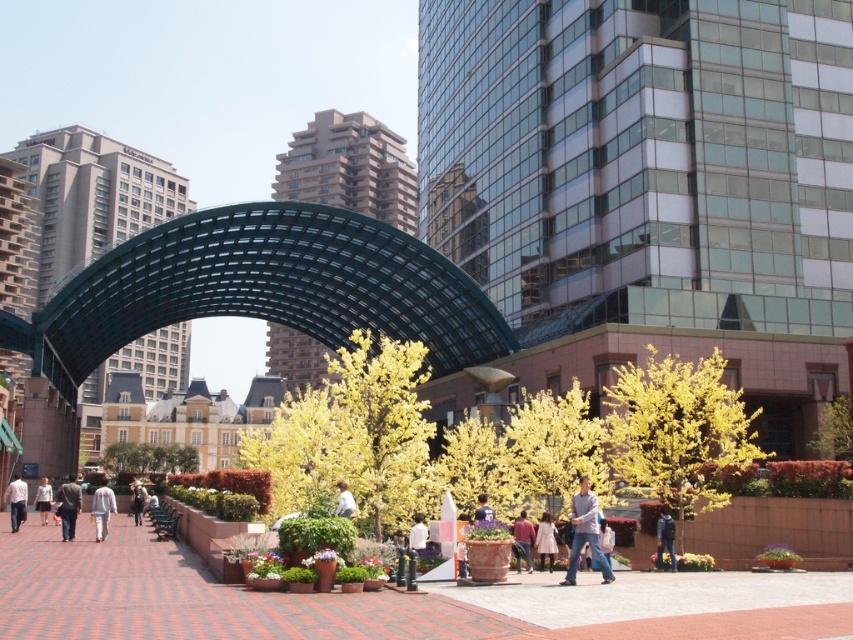
Question: Does matte brown coat at center appear on the right side of light brown leather jacket at center?

Choices:
 (A) no
 (B) yes

Answer: (B)

Question: In this image, where is brick pavement at center located relative to dark blue jacket at center?

Choices:
 (A) above
 (B) below

Answer: (B)

Question: Does dark blue jacket at center have a smaller size compared to light brown shirt at lower left?

Choices:
 (A) yes
 (B) no

Answer: (A)

Question: Which object is the farthest from the light gray cotton shirt at center?

Choices:
 (A) light brown leather jacket at center
 (B) light beige fabric jacket at lower left
 (C) light brown shirt at lower left
 (D) denim jacket at center

Answer: (C)

Question: Which object appears farthest from the camera in this image?

Choices:
 (A) brick pavement at center
 (B) white cotton shirt at center
 (C) dark blue jacket at center
 (D) light gray cotton shirt at center

Answer: (C)

Question: Which object is the farthest from the light gray cotton shirt at center?

Choices:
 (A) brick pavement at center
 (B) denim jacket at center

Answer: (A)